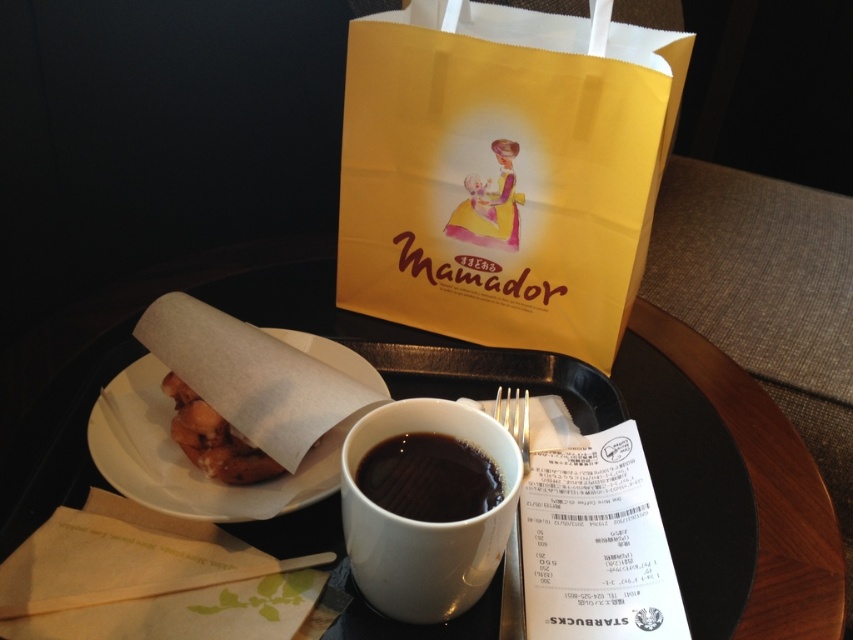
You are at a cafe and want to place your phone between the white ceramic mug at center and the brown paper plate at center. Which object should you move to make space?

The white ceramic mug at center is smaller than the brown paper plate at center, so moving the smaller mug would create more space for the phone.

You are a customer at a cafe and want to place your phone on the table. You see the white matte tray at center and the brown paper plate at center. Which object should you place your phone on to ensure it is closer to the right edge of the table?

The white matte tray at center is positioned on the right side of brown paper plate at center, so placing your phone on the white matte tray at center will be closer to the right edge of the table.

You are a barista at a Starbucks and need to place a new drink order on the table. The drink must be placed exactly 15 centimeters away from the brown paper plate at center. Can the white ceramic mug at center be moved to this new position without overlapping the plate?

The current distance between the white ceramic mug at center and the brown paper plate at center is 12.19 centimeters. Since the required distance is 15 centimeters, moving the mug further away from the plate would achieve the desired spacing. Therefore, yes, the white ceramic mug at center can be moved to the new position as long as it is placed 15 centimeters away from the brown paper plate at center.